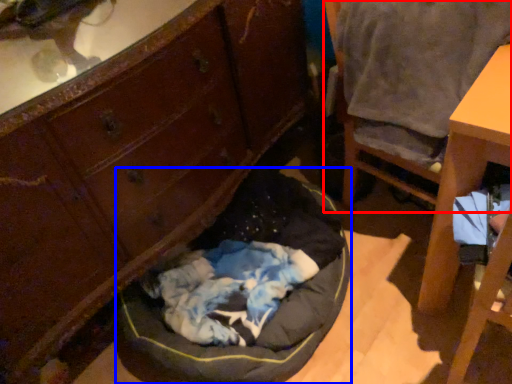
Question: Which object is closer to the camera taking this photo, chair (highlighted by a red box) or dog bed (highlighted by a blue box)?

Choices:
 (A) chair
 (B) dog bed

Answer: (A)